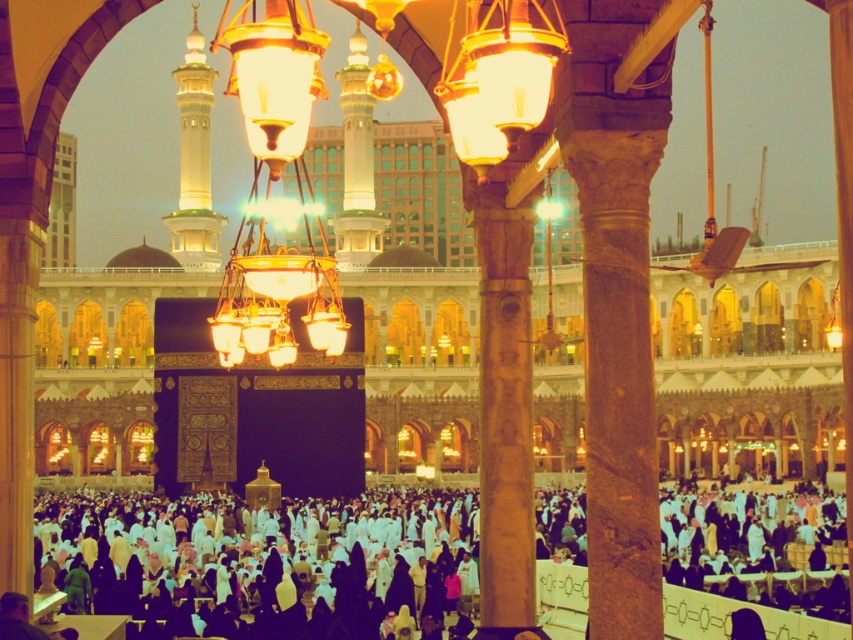
Question: Which object appears closest to the camera in this image?

Choices:
 (A) white matte crowd at center
 (B) gold metallic chandelier at center
 (C) wooden carved column at center

Answer: (B)

Question: Which of the following is the closest to the observer?

Choices:
 (A) gold metallic chandelier at center
 (B) white matte crowd at center
 (C) wooden carved column at center

Answer: (A)

Question: Which point is farther from the camera taking this photo?

Choices:
 (A) (378, 525)
 (B) (239, 244)

Answer: (A)

Question: Observing the image, what is the correct spatial positioning of white matte crowd at center in reference to wooden carved column at center?

Choices:
 (A) above
 (B) below

Answer: (B)

Question: Is wooden carved column at center below gold metallic chandelier at center?

Choices:
 (A) yes
 (B) no

Answer: (A)

Question: Is white matte crowd at center closer to camera compared to gold metallic chandelier at center?

Choices:
 (A) yes
 (B) no

Answer: (B)